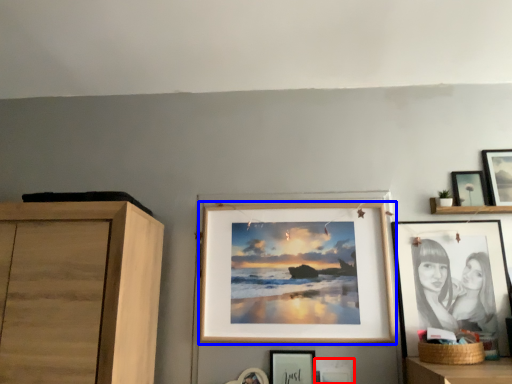
Question: Which object appears farthest to the camera in this image, picture frame (highlighted by a red box) or picture frame (highlighted by a blue box)?

Choices:
 (A) picture frame
 (B) picture frame

Answer: (B)